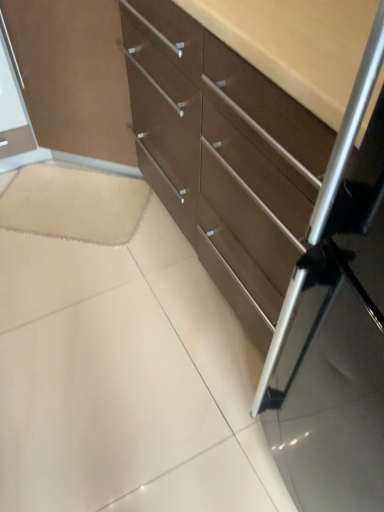
The width and height of the screenshot is (384, 512). In order to click on vacant area situated below beige soft carpet at lower left (from a real-world perspective) in this screenshot , I will do `click(35, 204)`.